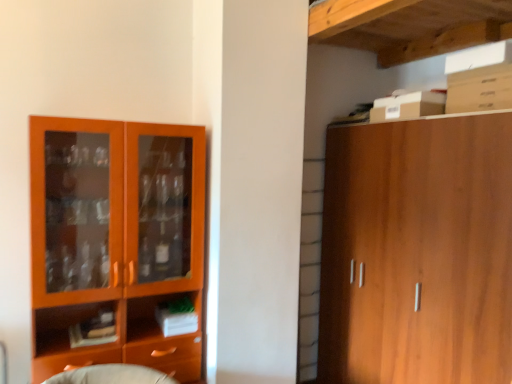
Question: From a real-world perspective, does white cardboard box at upper right sit lower than wooden cabinet at right?

Choices:
 (A) yes
 (B) no

Answer: (B)

Question: Does white cardboard box at upper right have a greater height compared to wooden cabinet at right?

Choices:
 (A) no
 (B) yes

Answer: (A)

Question: From the image's perspective, is white cardboard box at upper right over wooden cabinet at right?

Choices:
 (A) yes
 (B) no

Answer: (A)

Question: Is the surface of white cardboard box at upper right in direct contact with wooden cabinet at right?

Choices:
 (A) no
 (B) yes

Answer: (A)

Question: Is wooden cabinet at right located within white cardboard box at upper right?

Choices:
 (A) yes
 (B) no

Answer: (B)

Question: In terms of width, does orange wood cabinet at left look wider or thinner when compared to wooden cabinet at right?

Choices:
 (A) thin
 (B) wide

Answer: (A)

Question: Does point (57, 190) appear closer or farther from the camera than point (488, 230)?

Choices:
 (A) closer
 (B) farther

Answer: (B)

Question: From their relative heights in the image, would you say orange wood cabinet at left is taller or shorter than wooden cabinet at right?

Choices:
 (A) tall
 (B) short

Answer: (B)

Question: Considering the positions of orange wood cabinet at left and wooden cabinet at right in the image, is orange wood cabinet at left bigger or smaller than wooden cabinet at right?

Choices:
 (A) big
 (B) small

Answer: (B)

Question: From a real-world perspective, is orange wood cabinet at left positioned above or below white cardboard box at upper right?

Choices:
 (A) above
 (B) below

Answer: (B)

Question: Looking at the image, does orange wood cabinet at left seem bigger or smaller compared to white cardboard box at upper right?

Choices:
 (A) small
 (B) big

Answer: (B)

Question: Relative to white cardboard box at upper right, is orange wood cabinet at left in front or behind?

Choices:
 (A) behind
 (B) front

Answer: (B)

Question: Based on their positions, is orange wood cabinet at left located to the left or right of white cardboard box at upper right?

Choices:
 (A) right
 (B) left

Answer: (B)

Question: Is point (451, 263) closer or farther from the camera than point (53, 150)?

Choices:
 (A) closer
 (B) farther

Answer: (A)

Question: Would you say wooden cabinet at right is to the left or to the right of orange wood cabinet at left in the picture?

Choices:
 (A) right
 (B) left

Answer: (A)